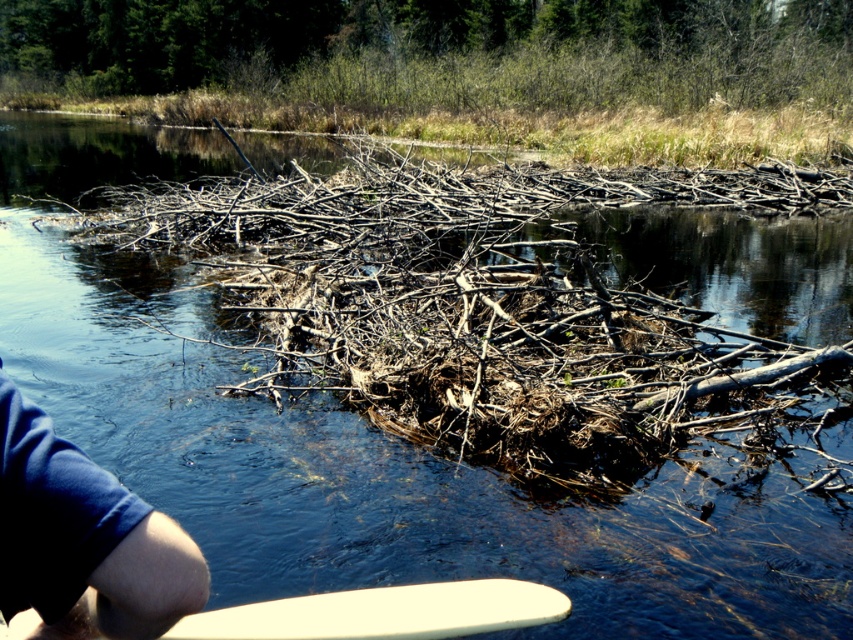
Question: Can you confirm if blue fabric arm at lower left is smaller than white smooth surfboard at lower center?

Choices:
 (A) no
 (B) yes

Answer: (A)

Question: Does blue fabric arm at lower left appear under white smooth surfboard at lower center?

Choices:
 (A) yes
 (B) no

Answer: (B)

Question: Which of the following is the closest to the observer?

Choices:
 (A) (67, 605)
 (B) (207, 624)

Answer: (A)

Question: Considering the relative positions of blue fabric arm at lower left and white smooth surfboard at lower center in the image provided, where is blue fabric arm at lower left located with respect to white smooth surfboard at lower center?

Choices:
 (A) left
 (B) right

Answer: (A)